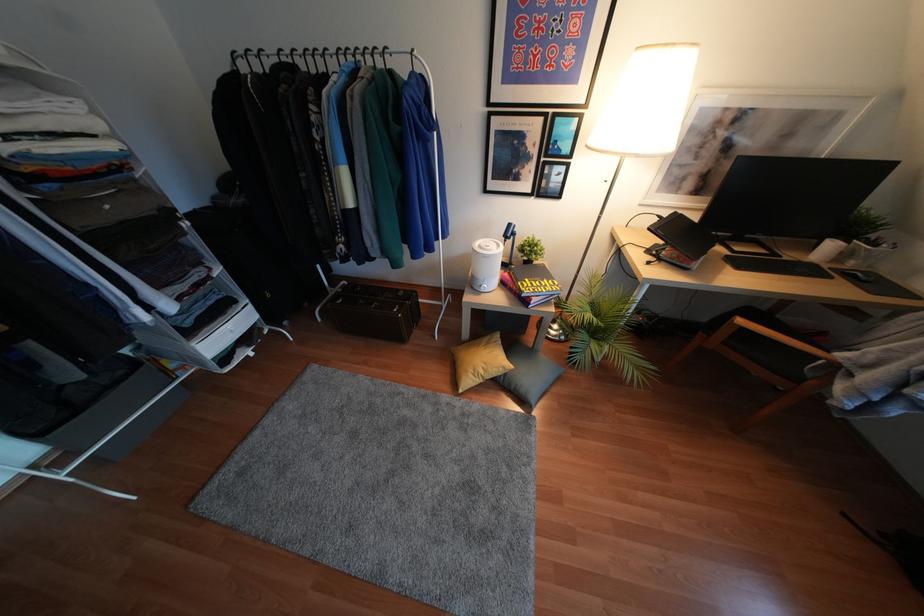
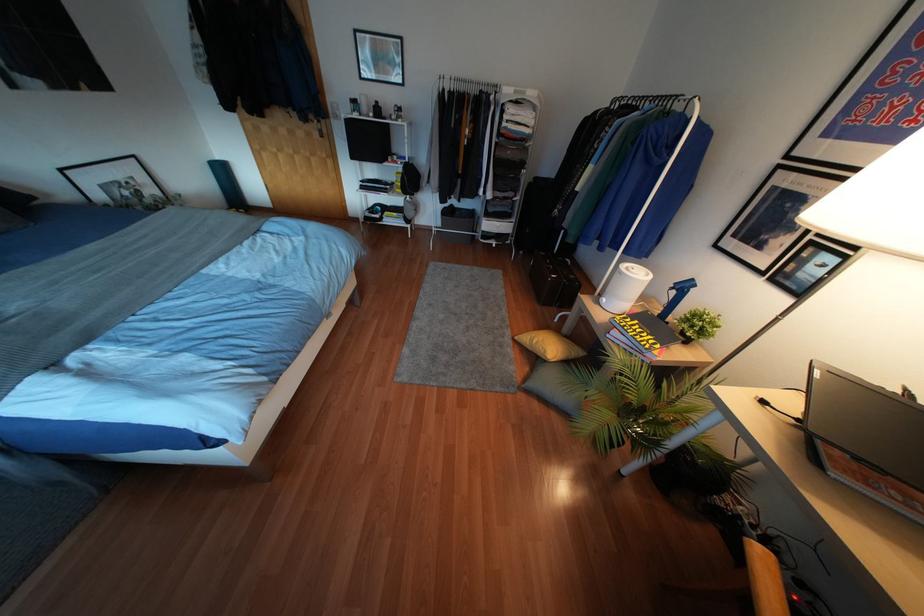
Question: I am providing you with two images of the same scene from different viewpoints. After the viewpoint changes to image2, which objects are now occluded?

Choices:
 (A) blue desk lamp
 (B) yellow cushion
 (C) small potted plant
 (D) none of these

Answer: (D)